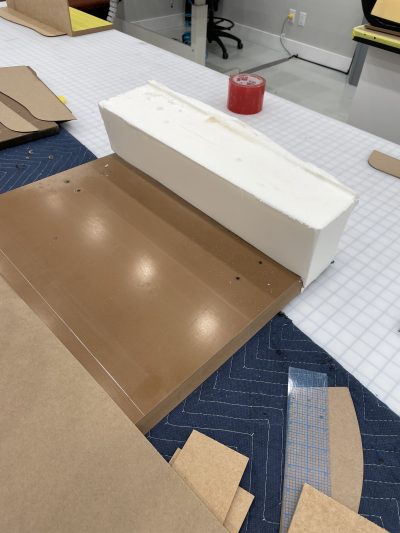
What are the coordinates of `electrical cable` in the screenshot? It's located at (283, 46).